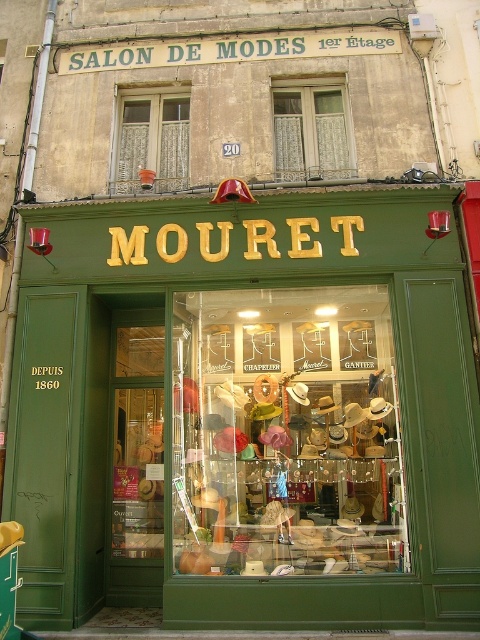
Question: Which object is farther from the camera taking this photo?

Choices:
 (A) green matte storefront at center
 (B) white lace curtains at upper center
 (C) multicolored fabric hats at center
 (D) clear glass window at center

Answer: (B)

Question: Is multicolored fabric hats at center to the left of white lace curtains at upper center from the viewer's perspective?

Choices:
 (A) no
 (B) yes

Answer: (A)

Question: Which of these objects is positioned closest to the multicolored fabric hats at center?

Choices:
 (A) green matte storefront at center
 (B) white lace curtains at upper center

Answer: (A)

Question: Does clear glass window at center have a greater width compared to white lace curtains at upper center?

Choices:
 (A) yes
 (B) no

Answer: (A)

Question: Which object is the closest to the multicolored fabric hats at center?

Choices:
 (A) clear glass window at center
 (B) white lace curtains at upper center

Answer: (A)

Question: Is multicolored fabric hats at center positioned before clear glass window at center?

Choices:
 (A) yes
 (B) no

Answer: (A)